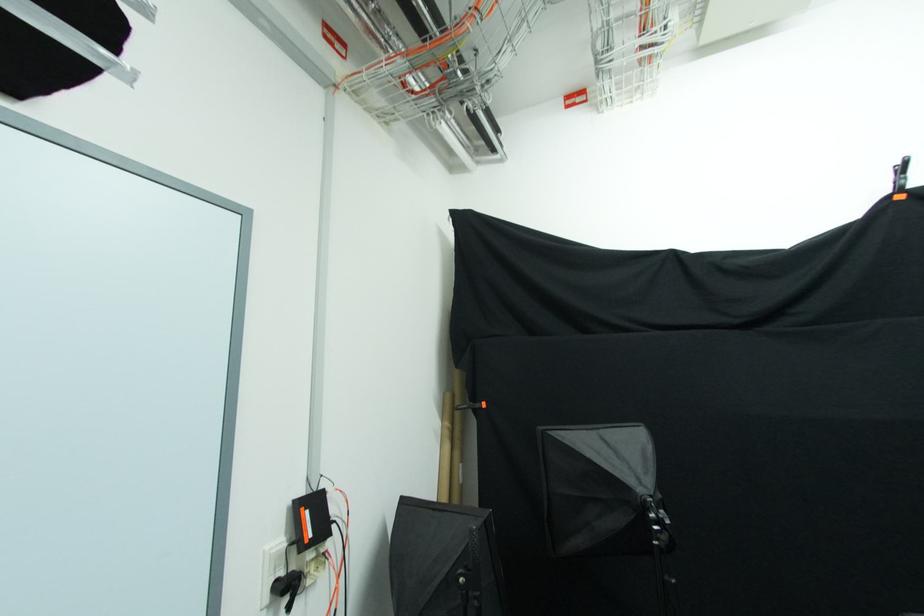
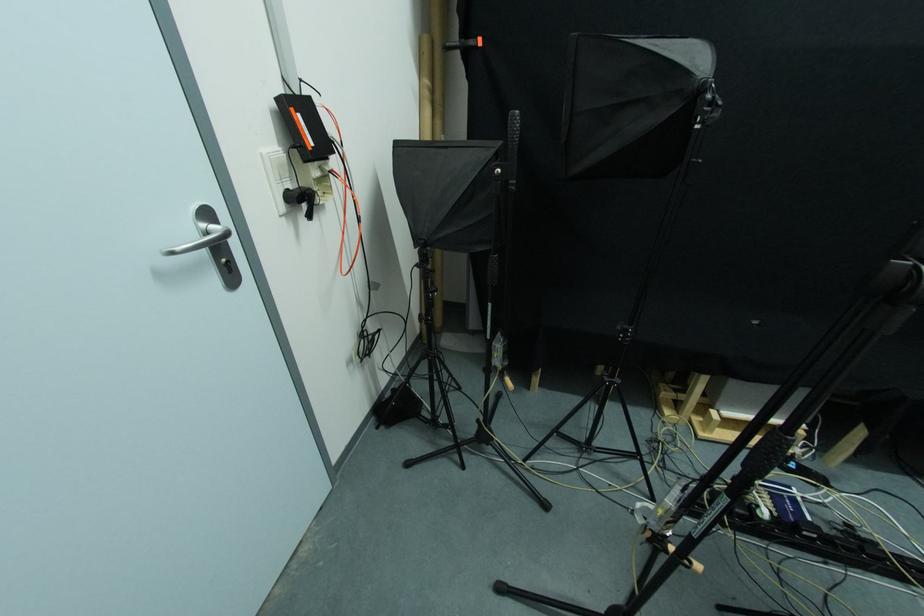
Find the pixel in the second image that matches point (266, 554) in the first image.

(262, 156)